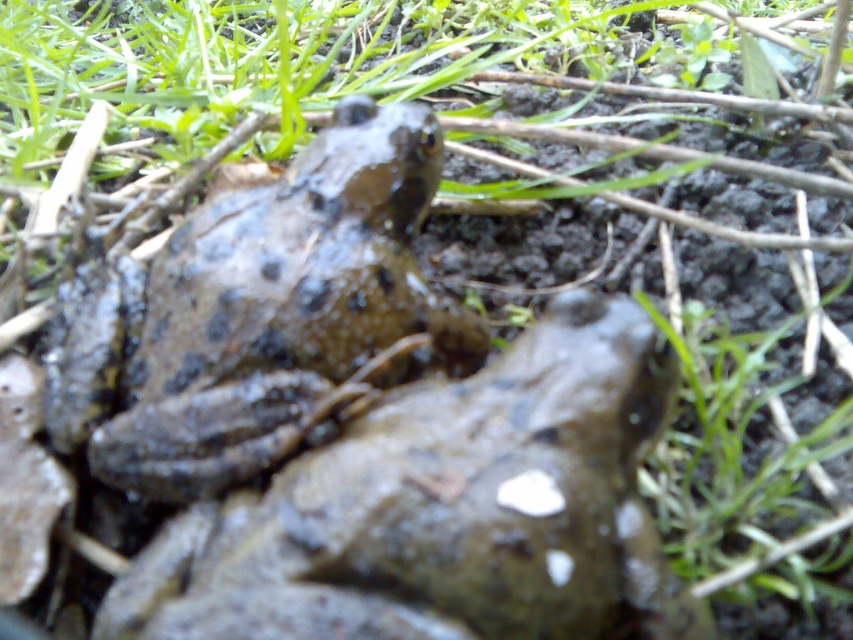
You are a nature photographer aiming to capture the speckled mud frog at center and the muddy skin frog at center in the same frame. Which frog should you focus on first to ensure both are in the frame without moving the camera?

The speckled mud frog at center is below the muddy skin frog at center, so you should focus on the muddy skin frog at center first to ensure both frogs remain in the frame without moving the camera.

You are a wildlife photographer trying to capture both the speckled mud frog at center and the muddy skin frog at center in a single frame. Given their sizes, which frog will appear larger in your photo?

The muddy skin frog at center will appear larger in the photo because it is bigger than the speckled mud frog at center.

You are a wildlife photographer trying to capture a speckled mud frog at center. Based on its position at point coordinates, where should you aim your camera to ensure the frog is centered in your shot?

To center the speckled mud frog at center in your shot, aim your camera at the coordinates point (x=445, y=512).